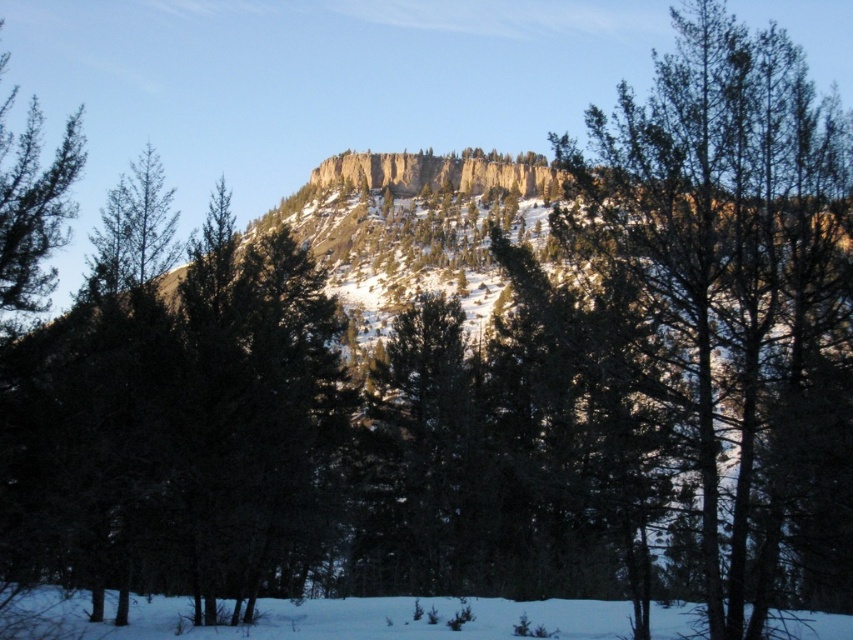
Does point (769, 440) come closer to viewer compared to point (10, 156)?

That is True.

Between green textured tree at center and green matte tree at left, which one appears on the right side from the viewer's perspective?

Positioned to the right is green textured tree at center.

Is point (846, 554) more distant than point (9, 234)?

That is False.

Find the location of a particular element. green textured tree at center is located at coordinates (733, 296).